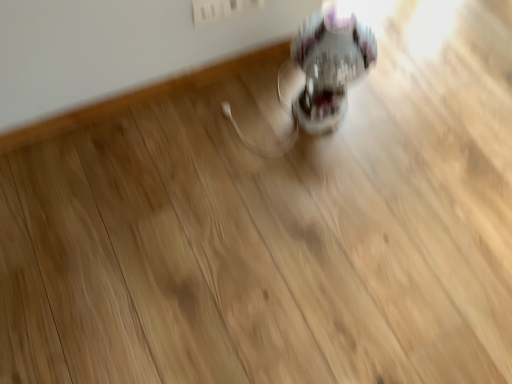
The image size is (512, 384). In order to click on vacant area that is situated to the right of translucent plastic swivel chair at center in this screenshot , I will do `click(375, 114)`.